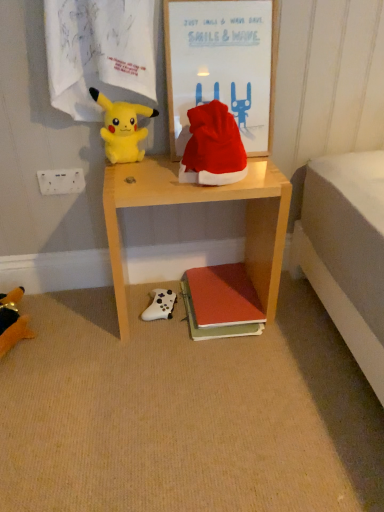
Where is `free space on the front side of white matte game controller at lower center, the second toy positioned from the top`? The image size is (384, 512). free space on the front side of white matte game controller at lower center, the second toy positioned from the top is located at coordinates (160, 341).